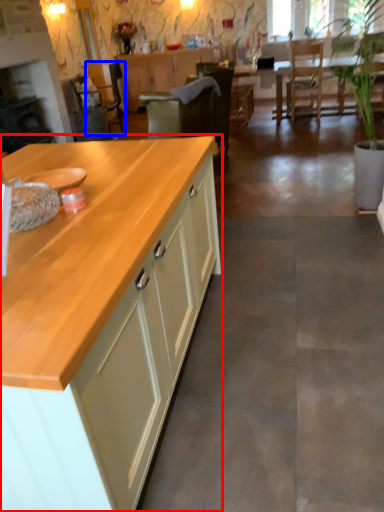
Question: Among these objects, which one is farthest to the camera, cabinetry (highlighted by a red box) or armchair (highlighted by a blue box)?

Choices:
 (A) cabinetry
 (B) armchair

Answer: (B)